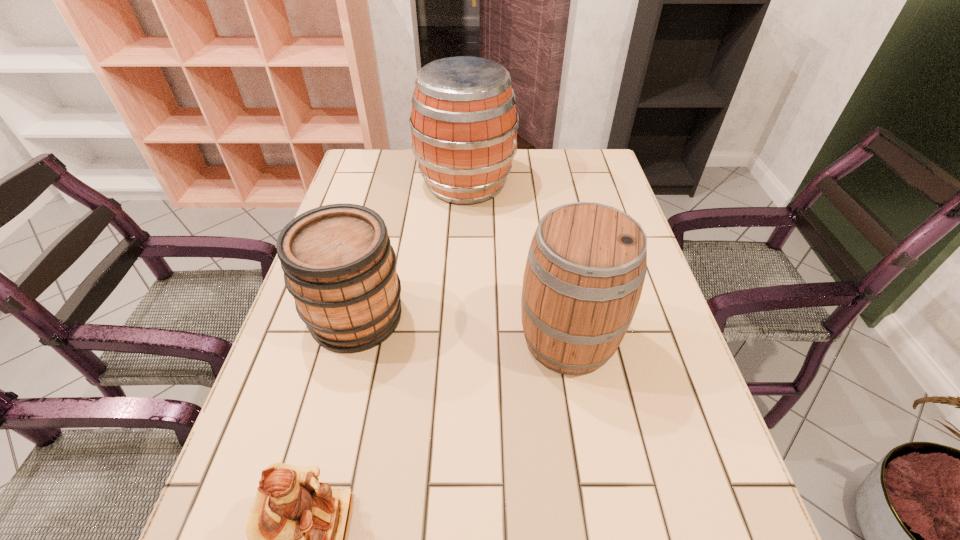
You are a GUI agent. You are given a task and a screenshot of the screen. Output one action in this format:
    pyautogui.click(x=<x>, y=<y>)
    Task: Click on the free space at the near edge of the desktop
    This screenshot has width=960, height=540.
    Given the screenshot: What is the action you would take?
    pyautogui.click(x=456, y=534)

At what (x,y) coordinates should I click in order to perform the action: click on vacant space at the left edge of the desktop. Please return your answer as a coordinate pair (x, y). This screenshot has width=960, height=540. Looking at the image, I should click on (225, 492).

Where is `vacant space at the right edge of the desktop`? The image size is (960, 540). vacant space at the right edge of the desktop is located at coordinates (621, 395).

This screenshot has height=540, width=960. In order to click on vacant space at the far left corner of the desktop in this screenshot , I will do `click(348, 185)`.

The height and width of the screenshot is (540, 960). Identify the location of free point at the far right corner. (563, 168).

Where is `vacant region between the second tallest cider and the farthest cider`? vacant region between the second tallest cider and the farthest cider is located at coordinates (517, 261).

The width and height of the screenshot is (960, 540). In order to click on vacant space that is in between the farthest object and the second tallest cider in this screenshot , I will do `click(517, 261)`.

Find the location of a particular element. This screenshot has height=540, width=960. vacant region between the shortest cider and the farthest cider is located at coordinates pyautogui.click(x=411, y=250).

Find the location of a particular element. This screenshot has width=960, height=540. vacant space that's between the shortest cider and the farthest cider is located at coordinates (411, 250).

The image size is (960, 540). Find the location of `vacant area that lies between the second tallest object and the shortest cider`. vacant area that lies between the second tallest object and the shortest cider is located at coordinates (463, 328).